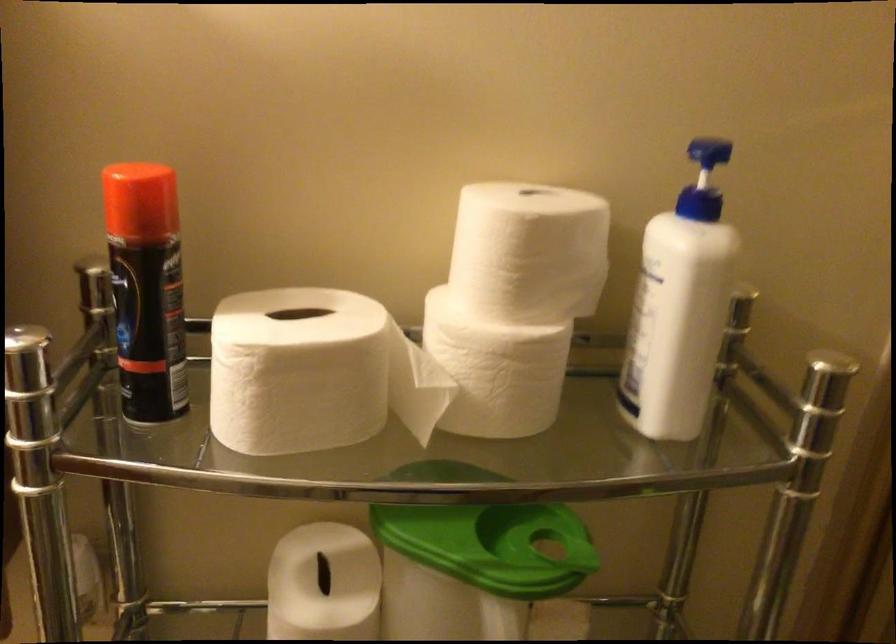
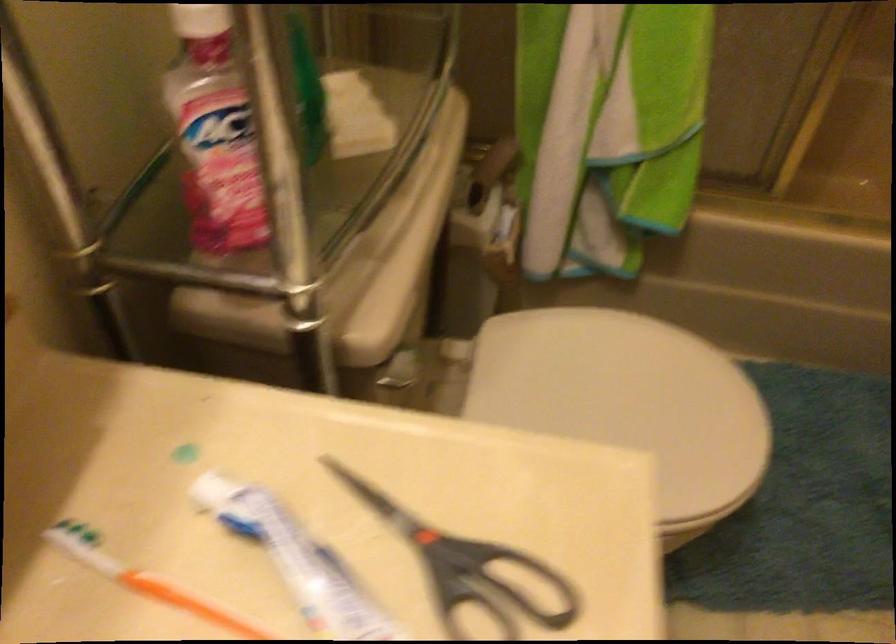
Based on the continuous images, in which direction is the camera rotating?

The rotation direction of the camera is right-down.